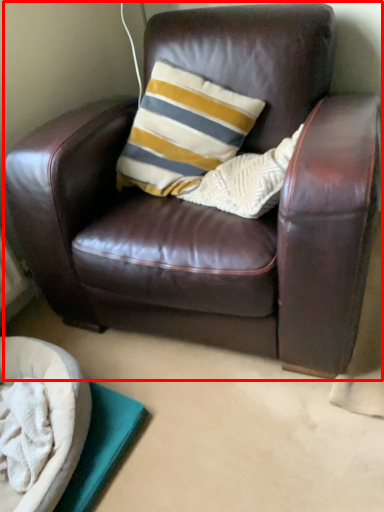
Question: From the image's perspective, considering the relative positions of chair (annotated by the red box) and dog bed in the image provided, where is chair (annotated by the red box) located with respect to the staircase?

Choices:
 (A) above
 (B) below

Answer: (A)